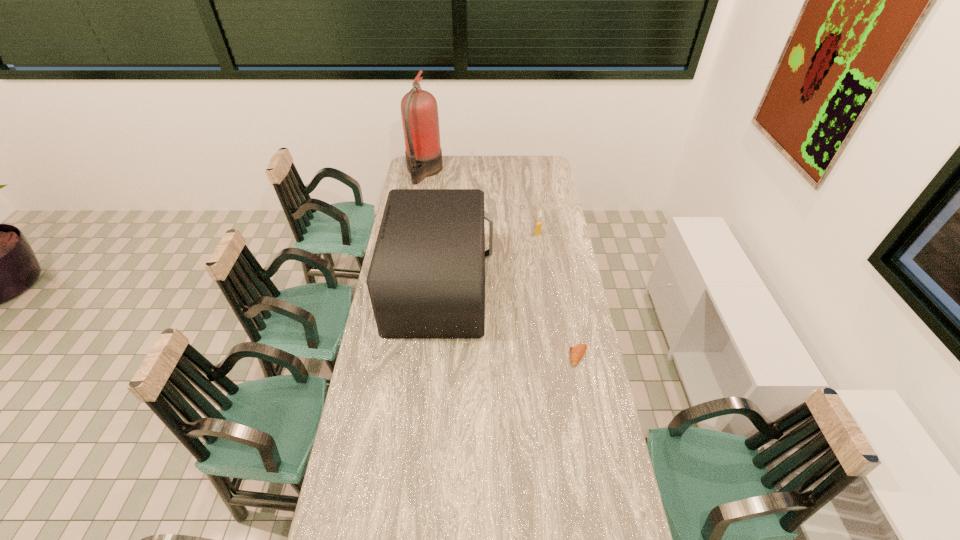
At what (x,y) coordinates should I click in order to perform the action: click on vacant point at the far right corner. Please return your answer as a coordinate pair (x, y). This screenshot has width=960, height=540. Looking at the image, I should click on (530, 169).

Locate an element on the screen. The image size is (960, 540). vacant space that is in between the second shortest object and the nearest object is located at coordinates (559, 295).

Identify the location of unoccupied area between the candle and the third shortest object. (489, 261).

At what (x,y) coordinates should I click in order to perform the action: click on free spot between the tallest object and the rightmost object. Please return your answer as a coordinate pair (x, y). Image resolution: width=960 pixels, height=540 pixels. Looking at the image, I should click on (501, 264).

At what (x,y) coordinates should I click in order to perform the action: click on empty space that is in between the second tallest object and the third nearest object. Please return your answer as a coordinate pair (x, y). This screenshot has width=960, height=540. Looking at the image, I should click on (489, 261).

Identify the location of unoccupied area between the third object from left to right and the microwave oven. This screenshot has width=960, height=540. (489, 261).

The height and width of the screenshot is (540, 960). Find the location of `blank region between the crescent roll and the tallest object`. blank region between the crescent roll and the tallest object is located at coordinates (501, 264).

Locate an element on the screen. This screenshot has width=960, height=540. vacant area that lies between the second nearest object and the second shortest object is located at coordinates (489, 261).

Identify the location of empty space that is in between the farthest object and the crescent roll. Image resolution: width=960 pixels, height=540 pixels. (501, 264).

The height and width of the screenshot is (540, 960). Find the location of `the second closest object to the tallest object`. the second closest object to the tallest object is located at coordinates tap(538, 224).